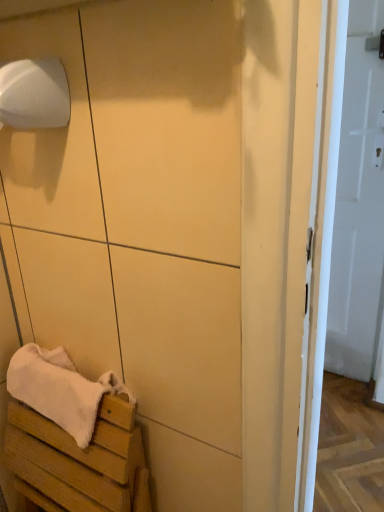
Where is `white matte toilet paper at upper left`? white matte toilet paper at upper left is located at coordinates (34, 94).

Where is `white wood bench at lower left`? white wood bench at lower left is located at coordinates (80, 460).

Locate an element on the screen. The width and height of the screenshot is (384, 512). wooden crate at lower left is located at coordinates (141, 224).

Locate an element on the screen. white soft towel at lower left is located at coordinates (64, 391).

Identify the location of white matte toilet paper at upper left. This screenshot has height=512, width=384. (34, 94).

Does white soft towel at lower left appear on the right side of white matte toilet paper at upper left?

Indeed, white soft towel at lower left is positioned on the right side of white matte toilet paper at upper left.

In order to click on toilet paper on the left of the white soft towel at lower left in this screenshot , I will do (34, 94).

Does point (83, 425) appear closer or farther from the camera than point (57, 80)?

Point (83, 425).

Does white soft towel at lower left have a lesser width compared to white matte toilet paper at upper left?

In fact, white soft towel at lower left might be wider than white matte toilet paper at upper left.

Does white soft towel at lower left have a greater height compared to white wood bench at lower left?

In fact, white soft towel at lower left may be shorter than white wood bench at lower left.

Is white soft towel at lower left to the right of white wood bench at lower left from the viewer's perspective?

In fact, white soft towel at lower left is to the left of white wood bench at lower left.

From a real-world perspective, is white soft towel at lower left physically located above or below white wood bench at lower left?

In terms of real-world spatial position, white soft towel at lower left is above white wood bench at lower left.

From a real-world perspective, who is located higher, white glossy door at right or wooden crate at lower left?

From a 3D spatial view, wooden crate at lower left is above.

Locate an element on the screen. The image size is (384, 512). cabinetry lying on the left of white glossy door at right is located at coordinates (141, 224).

Does point (366, 110) come farther from viewer compared to point (158, 267)?

That is True.

Is white glossy door at right wider than wooden crate at lower left?

Yes.

Where is `furniture below the white glossy door at right (from a real-world perspective)`? This screenshot has height=512, width=384. furniture below the white glossy door at right (from a real-world perspective) is located at coordinates (80, 460).

In the image, is white wood bench at lower left positioned in front of or behind white glossy door at right?

white wood bench at lower left is positioned closer to the viewer than white glossy door at right.

Which of these two, white wood bench at lower left or white glossy door at right, stands shorter?

Standing shorter between the two is white wood bench at lower left.

From a real-world perspective, which is physically above, white glossy door at right or white matte toilet paper at upper left?

From a 3D spatial view, white matte toilet paper at upper left is above.

Does white glossy door at right have a smaller size compared to white matte toilet paper at upper left?

No, white glossy door at right is not smaller than white matte toilet paper at upper left.

Could you tell me if white glossy door at right is facing white matte toilet paper at upper left?

No, white glossy door at right is not aimed at white matte toilet paper at upper left.

How different are the orientations of white glossy door at right and white matte toilet paper at upper left in degrees?

The angular difference between white glossy door at right and white matte toilet paper at upper left is 1.84 degrees.

Is there a large distance between wooden crate at lower left and white soft towel at lower left?

No, wooden crate at lower left is not far away from white soft towel at lower left.

From the image's perspective, is wooden crate at lower left above white soft towel at lower left?

Yes, from the image's perspective, wooden crate at lower left is above white soft towel at lower left.

Is wooden crate at lower left spatially inside white soft towel at lower left, or outside of it?

wooden crate at lower left is spatially situated outside white soft towel at lower left.

From a real-world perspective, is wooden crate at lower left over white soft towel at lower left?

Indeed, from a real-world perspective, wooden crate at lower left stands above white soft towel at lower left.

Which of these two, wooden crate at lower left or white matte toilet paper at upper left, stands shorter?

Standing shorter between the two is white matte toilet paper at upper left.

Between wooden crate at lower left and white matte toilet paper at upper left, which one appears on the right side from the viewer's perspective?

wooden crate at lower left.

In terms of size, does wooden crate at lower left appear bigger or smaller than white matte toilet paper at upper left?

In the image, wooden crate at lower left appears to be larger than white matte toilet paper at upper left.

Locate an element on the screen. The image size is (384, 512). bath towel behind the white matte toilet paper at upper left is located at coordinates (64, 391).

Where is `bath towel located on the left of white wood bench at lower left`? The height and width of the screenshot is (512, 384). bath towel located on the left of white wood bench at lower left is located at coordinates (64, 391).

Looking at the image, which one is located further to wooden crate at lower left, white soft towel at lower left or white glossy door at right?

white glossy door at right.

From the image, which object appears to be nearer to wooden crate at lower left, white soft towel at lower left or white matte toilet paper at upper left?

Among the two, white soft towel at lower left is located nearer to wooden crate at lower left.

Based on their spatial positions, is white glossy door at right or white wood bench at lower left closer to white soft towel at lower left?

white wood bench at lower left.

In the scene shown: From the image, which object appears to be nearer to white soft towel at lower left, white wood bench at lower left or white matte toilet paper at upper left?

Among the two, white wood bench at lower left is located nearer to white soft towel at lower left.

Based on their spatial positions, is white soft towel at lower left or white wood bench at lower left closer to wooden crate at lower left?

Based on the image, white soft towel at lower left appears to be nearer to wooden crate at lower left.

Based on their spatial positions, is white matte toilet paper at upper left or white wood bench at lower left closer to white soft towel at lower left?

The object closer to white soft towel at lower left is white wood bench at lower left.

Looking at the image, which one is located closer to white glossy door at right, white soft towel at lower left or white wood bench at lower left?

white soft towel at lower left lies closer to white glossy door at right than the other object.

Estimate the real-world distances between objects in this image. Which object is further from wooden crate at lower left, white matte toilet paper at upper left or white wood bench at lower left?

Among the two, white matte toilet paper at upper left is located further to wooden crate at lower left.

Locate an element on the screen. This screenshot has height=512, width=384. cabinetry situated between white wood bench at lower left and white glossy door at right from left to right is located at coordinates (141, 224).

You are a GUI agent. You are given a task and a screenshot of the screen. Output one action in this format:
    pyautogui.click(x=<x>, y=<y>)
    Task: Click on the cabinetry between white soft towel at lower left and white glossy door at right in the horizontal direction
    This screenshot has height=512, width=384.
    Given the screenshot: What is the action you would take?
    pyautogui.click(x=141, y=224)

Locate an element on the screen. The width and height of the screenshot is (384, 512). cabinetry between white matte toilet paper at upper left and white soft towel at lower left in the up-down direction is located at coordinates (141, 224).

You are a GUI agent. You are given a task and a screenshot of the screen. Output one action in this format:
    pyautogui.click(x=<x>, y=<y>)
    Task: Click on the cabinetry between white matte toilet paper at upper left and white glossy door at right from left to right
    
    Given the screenshot: What is the action you would take?
    pyautogui.click(x=141, y=224)